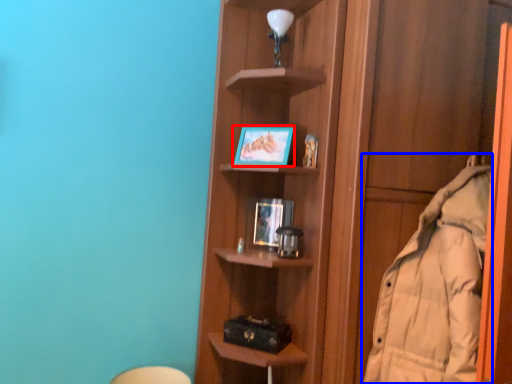
Question: Among these objects, which one is farthest to the camera, picture frame (highlighted by a red box) or coat (highlighted by a blue box)?

Choices:
 (A) picture frame
 (B) coat

Answer: (A)